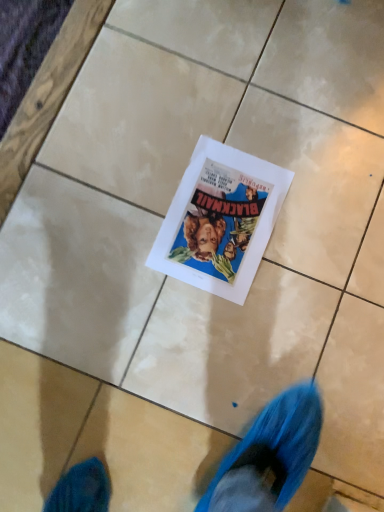
What is the approximate width of matte paper poster at center?

It is 11.87 inches.

This screenshot has width=384, height=512. What do you see at coordinates (220, 220) in the screenshot?
I see `matte paper poster at center` at bounding box center [220, 220].

Locate an element on the screen. matte paper poster at center is located at coordinates (220, 220).

What are the coordinates of `matte paper poster at center` in the screenshot? It's located at (220, 220).